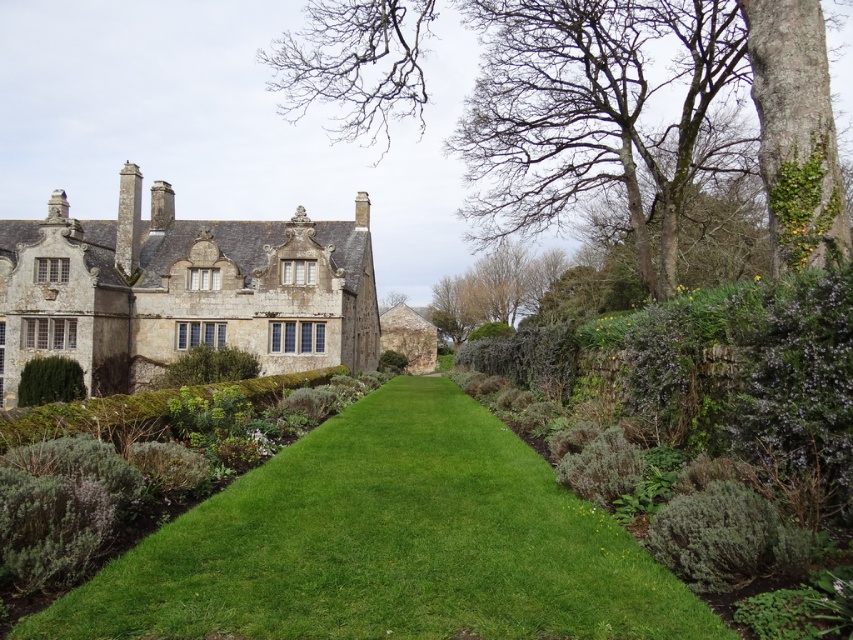
You are a gardener planning to trim the hedges in the garden. The green leafy hedge at center and the green leafy hedge at left need to be trimmed to the same width. Which hedge requires more trimming to achieve this goal?

The green leafy hedge at center might be wider than green leafy hedge at left, so it requires more trimming to match the width of the green leafy hedge at left.

You are standing at the entrance of the garden and want to take a photo of both the green grass at center and the bare wood tree at upper center. Which object should you focus on first to ensure both are in clear view?

You should focus on the green grass at center first since it is closer to you than the bare wood tree at upper center, ensuring both are in clear view by adjusting the focus accordingly.